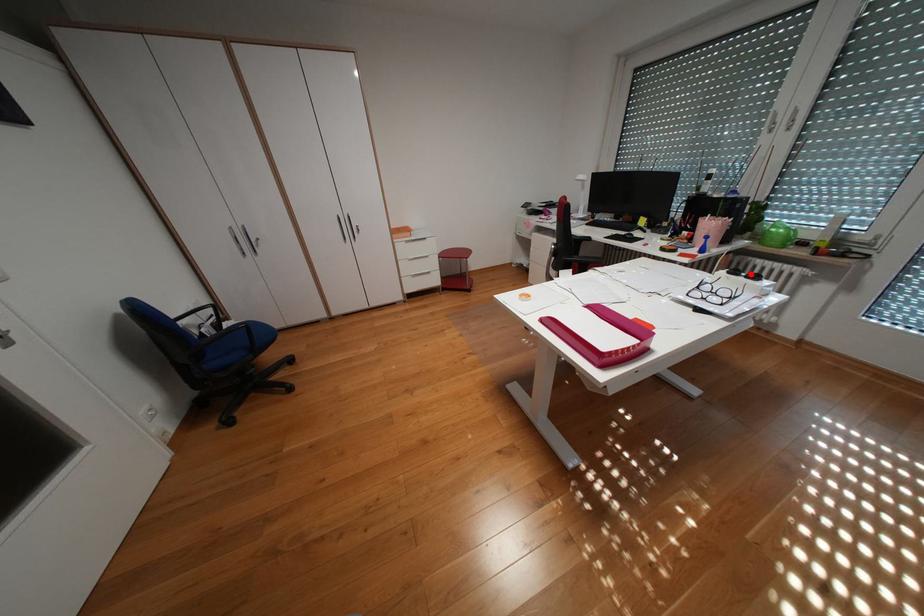
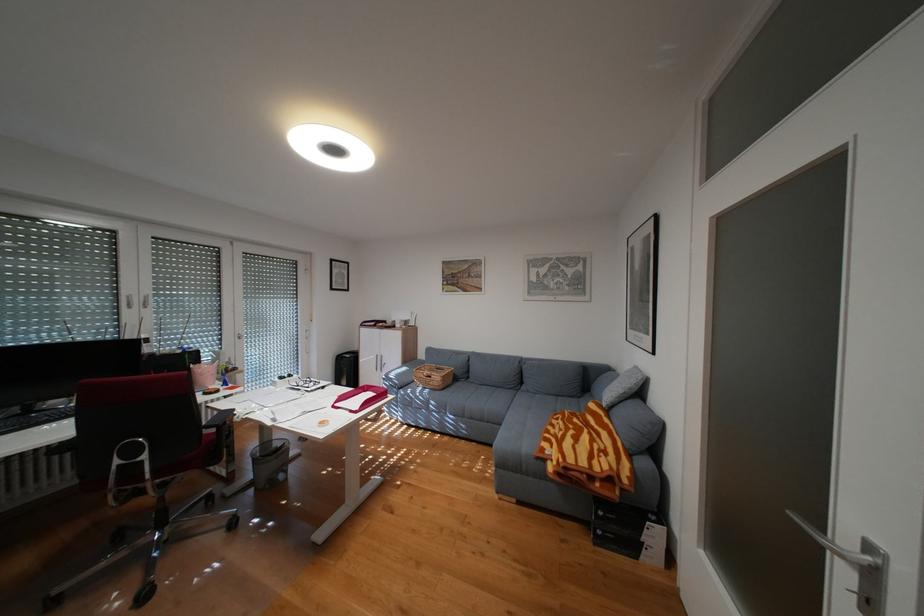
Question: I am providing you with two images of the same scene from different viewpoints. Image1 has a red point marked. In image2, the corresponding 3D location appears at what relative position? Reply with the corresponding letter.

Choices:
 (A) Closer
 (B) Farther

Answer: (A)